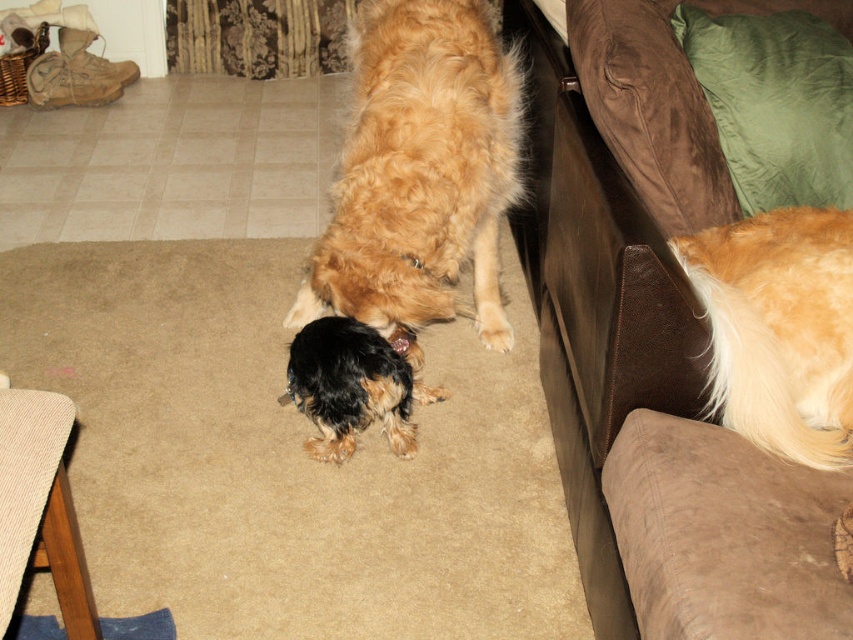
You are a dog owner trying to place a new dog bed for the smaller dog. The bed is 1 meter long. Given the location of the shiny black fur at center and the brown suede couch at right, can you fit the bed between them?

The brown suede couch at right is located above the shiny black fur at center, so the vertical distance between them may be insufficient for placing a 1 meter long dog bed horizontally. Check the horizontal space available between them instead.

Based on the photo, you are a dog owner who wants to place a small dog treat at the point with coordinates point (596, 307). Where should you place the treat?

The point (596, 307) is located on the brown suede couch at right, so place the treat on the brown suede couch at right.